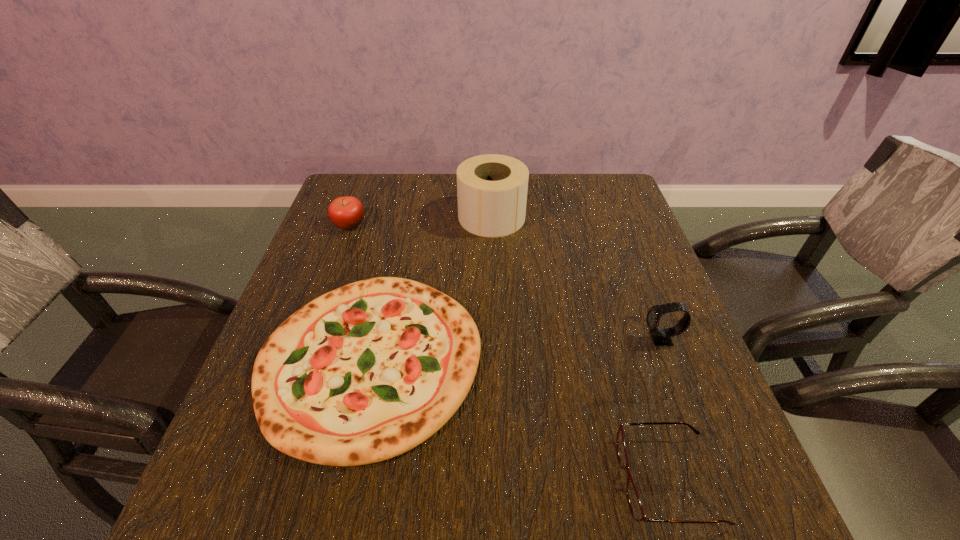
Locate an element on the screen. The height and width of the screenshot is (540, 960). spectacles positioned at the right edge is located at coordinates (635, 505).

You are a GUI agent. You are given a task and a screenshot of the screen. Output one action in this format:
    pyautogui.click(x=<x>, y=<y>)
    Task: Click on the object present at the far left corner
    Image resolution: width=960 pixels, height=540 pixels.
    Given the screenshot: What is the action you would take?
    pyautogui.click(x=347, y=212)

Identify the location of object that is at the near right corner. (635, 505).

Find the location of a particular element. The height and width of the screenshot is (540, 960). free space at the far edge of the desktop is located at coordinates (387, 212).

In the image, there is a desktop. At what (x,y) coordinates should I click in order to perform the action: click on free space at the left edge. Please return your answer as a coordinate pair (x, y). This screenshot has height=540, width=960. Looking at the image, I should click on (341, 261).

The height and width of the screenshot is (540, 960). What are the coordinates of `free spot at the right edge of the desktop` in the screenshot? It's located at (648, 246).

Locate an element on the screen. This screenshot has height=540, width=960. free spot at the far left corner of the desktop is located at coordinates (358, 192).

Where is `free space that is in between the tallest object and the apple`? The height and width of the screenshot is (540, 960). free space that is in between the tallest object and the apple is located at coordinates (420, 221).

I want to click on vacant point located between the tallest object and the apple, so click(420, 221).

This screenshot has width=960, height=540. In order to click on blank region between the spectacles and the apple in this screenshot , I will do `click(509, 352)`.